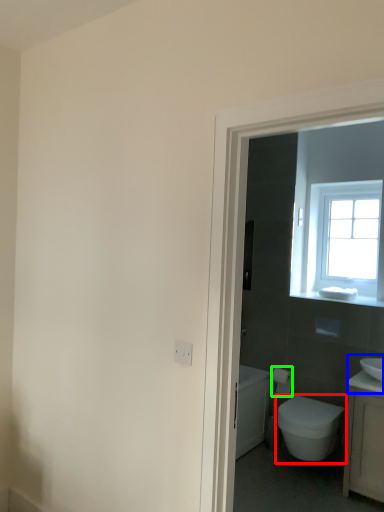
Question: Which object is the farthest from bidet (highlighted by a red box)? Choose among these: sink (highlighted by a blue box) or toilet paper (highlighted by a green box).

Choices:
 (A) sink
 (B) toilet paper

Answer: (B)